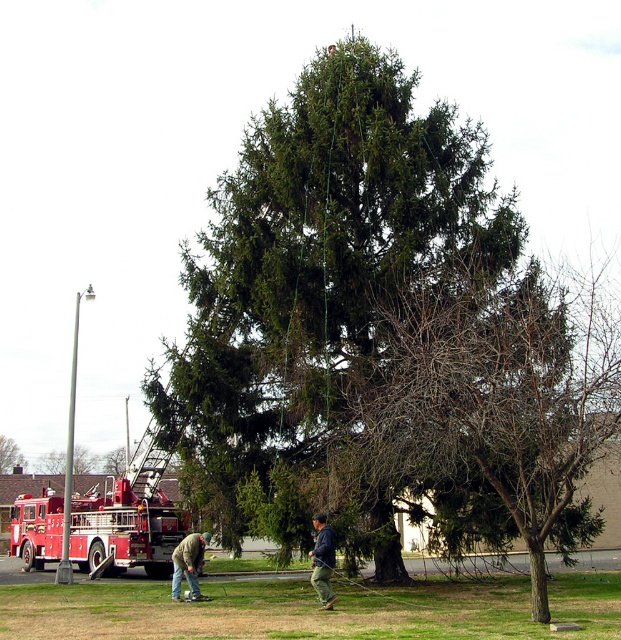
Question: Which point is farther from the camera taking this photo?

Choices:
 (A) (551, 314)
 (B) (388, 529)
 (C) (153, 474)
 (D) (4, 467)

Answer: (D)

Question: Which point is farther to the camera?

Choices:
 (A) (19, 452)
 (B) (396, 557)
 (C) (319, 554)
 (D) (173, 566)

Answer: (A)

Question: Considering the relative positions of green textured tree at center and dark blue jeans at center in the image provided, where is green textured tree at center located with respect to dark blue jeans at center?

Choices:
 (A) below
 (B) above

Answer: (B)

Question: Is brushed metal ladder at center in front of dark blue jeans at center?

Choices:
 (A) yes
 (B) no

Answer: (B)

Question: Based on their relative distances, which object is nearer to the dark blue jeans at center?

Choices:
 (A) green textured tree at center
 (B) bare branches at center
 (C) green matte tree at center
 (D) green denim jacket at lower left

Answer: (D)

Question: From the image, what is the correct spatial relationship of green textured tree at center in relation to brushed metal fire truck at lower left?

Choices:
 (A) below
 (B) above

Answer: (B)